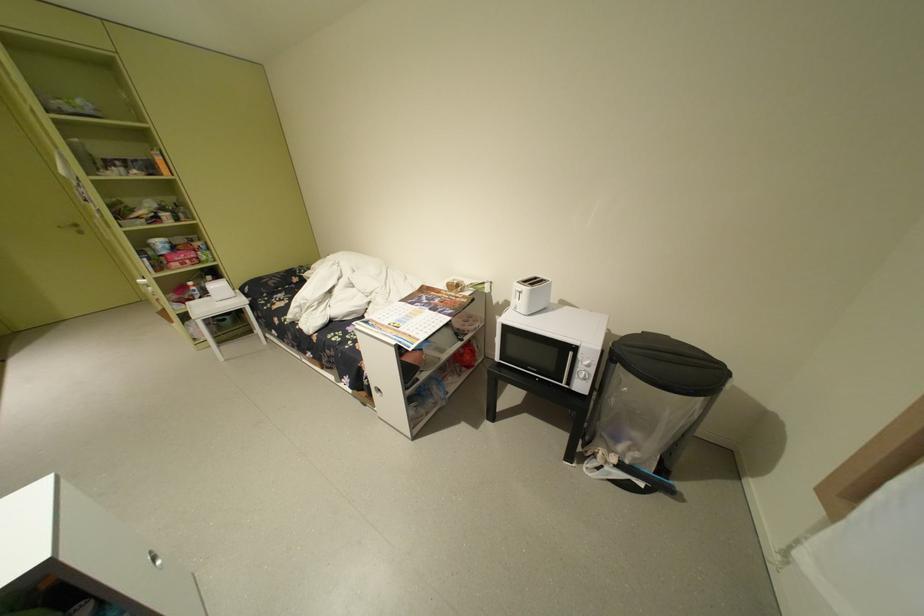
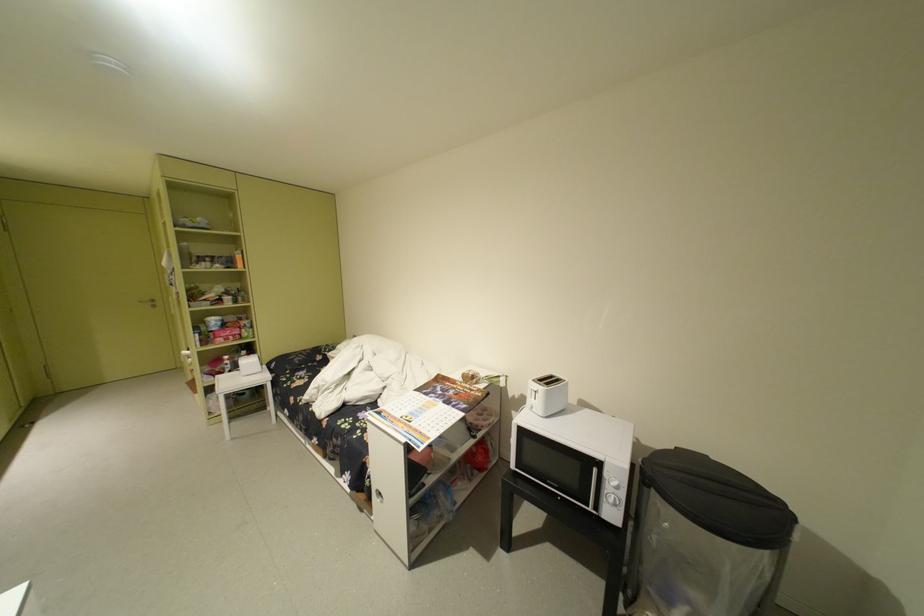
Question: The first image is from the beginning of the video and the second image is from the end. How did the camera likely rotate when shooting the video?

Choices:
 (A) Left
 (B) Right
 (C) Up
 (D) Down

Answer: (C)